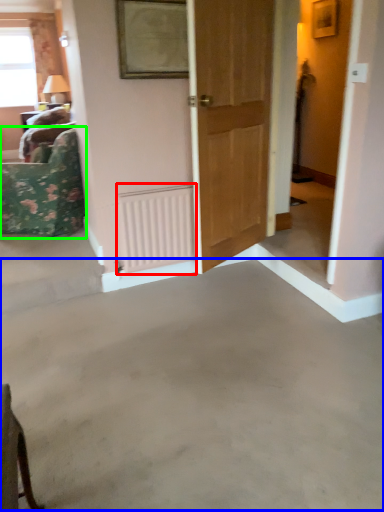
Question: Which is farther away from radiator (highlighted by a red box)? concrete (highlighted by a blue box) or furniture (highlighted by a green box)?

Choices:
 (A) concrete
 (B) furniture

Answer: (A)